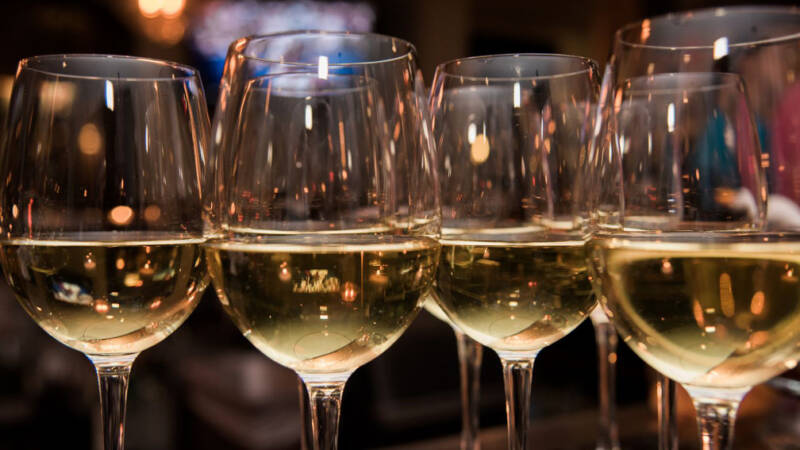
Find the location of a particular element. The width and height of the screenshot is (800, 450). wine in glass is located at coordinates (146, 280), (314, 266), (604, 313), (700, 313).